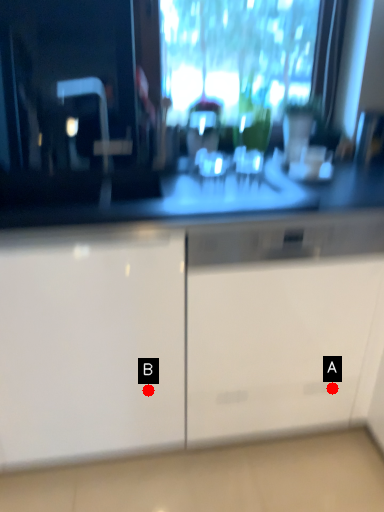
Question: Two points are circled on the image, labeled by A and B beside each circle. Among these points, which one is farthest from the camera?

Choices:
 (A) A is further
 (B) B is further

Answer: (A)